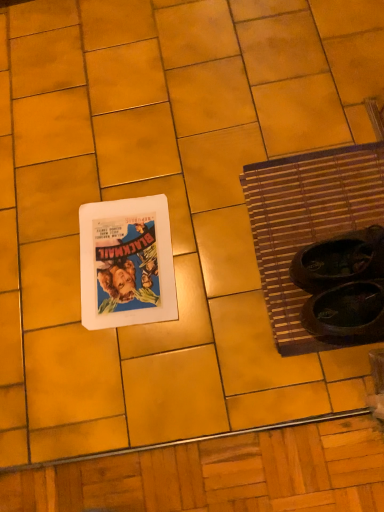
Where is `vacant space situated above brown woven mat at right (from a real-world perspective)`? The height and width of the screenshot is (512, 384). vacant space situated above brown woven mat at right (from a real-world perspective) is located at coordinates (325, 216).